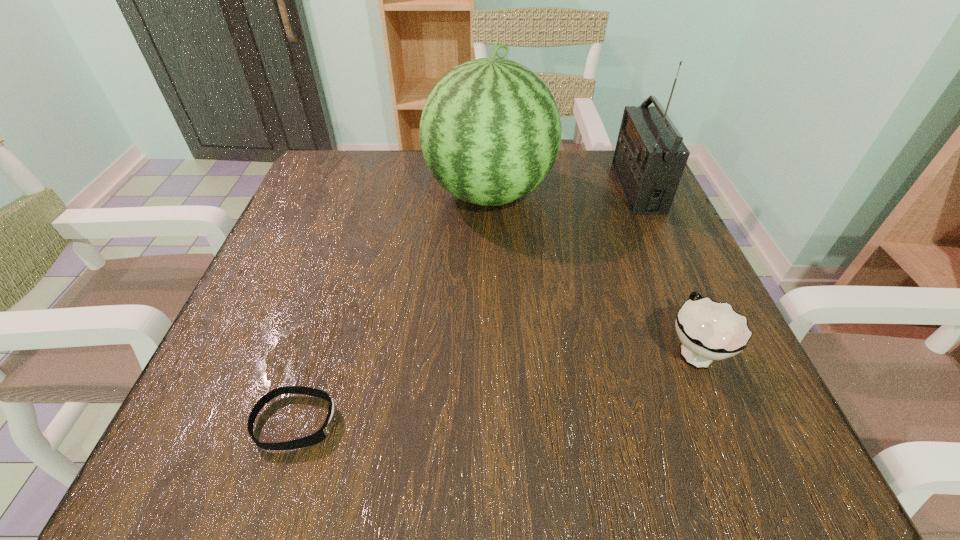
Find the location of a particular element. vacant space located 0.370m on the side of the second nearest object with the handle is located at coordinates (627, 190).

Identify the location of free space located on the side of the second nearest object with the handle. The height and width of the screenshot is (540, 960). (636, 214).

Identify the location of vacant position located on the side of the second nearest object with the handle. coord(634,206).

I want to click on vacant space located 0.380m on the display of the leftmost object, so click(x=618, y=422).

Identify the location of watermelon that is at the far edge. This screenshot has width=960, height=540. (490, 131).

You are a GUI agent. You are given a task and a screenshot of the screen. Output one action in this format:
    pyautogui.click(x=<x>, y=<y>)
    Task: Click on the radio receiver present at the far edge
    The width and height of the screenshot is (960, 540).
    Given the screenshot: What is the action you would take?
    pyautogui.click(x=649, y=159)

Where is `object that is at the near edge`? The height and width of the screenshot is (540, 960). object that is at the near edge is located at coordinates (322, 433).

This screenshot has width=960, height=540. In order to click on object that is at the left edge in this screenshot , I will do `click(322, 433)`.

At what (x,y) coordinates should I click in order to perform the action: click on radio receiver at the right edge. Please return your answer as a coordinate pair (x, y). Looking at the image, I should click on (649, 159).

Identify the location of cup that is at the right edge. (708, 330).